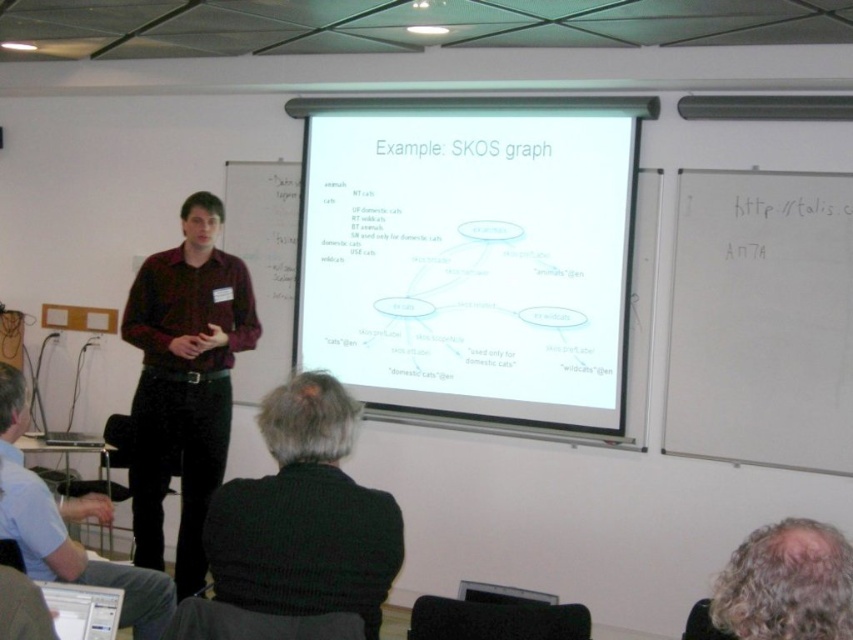
Question: Does white paper at center appear on the right side of matte red shirt at center?

Choices:
 (A) no
 (B) yes

Answer: (B)

Question: Is white paper at center to the left of matte red shirt at center from the viewer's perspective?

Choices:
 (A) yes
 (B) no

Answer: (B)

Question: Is matte red shirt at center to the left of dark brown leather jacket at lower left from the viewer's perspective?

Choices:
 (A) no
 (B) yes

Answer: (B)

Question: Which object is farther from the camera taking this photo?

Choices:
 (A) matte red shirt at center
 (B) white paper at center

Answer: (B)

Question: Which of the following is the farthest from the observer?

Choices:
 (A) (605, 268)
 (B) (64, 499)

Answer: (B)

Question: Which of the following is the closest to the observer?

Choices:
 (A) click(234, 308)
 (B) click(347, 346)
 (C) click(24, 387)

Answer: (C)